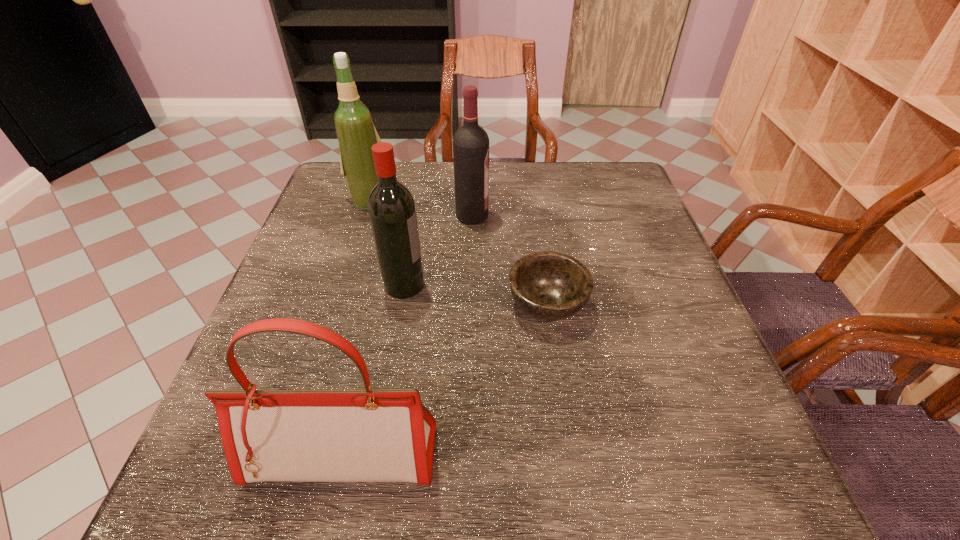
Identify the location of vacant space at the far left corner of the desktop. point(330,176).

The image size is (960, 540). In the image, there is a desktop. Identify the location of vacant space at the far right corner. (635, 187).

The height and width of the screenshot is (540, 960). I want to click on free spot between the nearest wine bottle and the rightmost object, so click(x=476, y=294).

Where is `free spot between the handbag and the leftmost wine bottle`? free spot between the handbag and the leftmost wine bottle is located at coordinates (357, 329).

Where is `free area in between the second wine bottle from right to left and the handbag`? This screenshot has height=540, width=960. free area in between the second wine bottle from right to left and the handbag is located at coordinates (373, 370).

Find the location of `free spot between the bowl and the nearest wine bottle`. free spot between the bowl and the nearest wine bottle is located at coordinates coord(476,294).

Locate an element on the screen. This screenshot has width=960, height=540. vacant space that is in between the shortest object and the second wine bottle from left to right is located at coordinates (476, 294).

Find the location of a particular element. vacant region between the nearest object and the nearest wine bottle is located at coordinates (373, 370).

I want to click on vacant area that lies between the rightmost object and the rightmost wine bottle, so click(510, 260).

This screenshot has width=960, height=540. In order to click on free point between the second wine bottle from left to right and the shortest object in this screenshot , I will do `click(476, 294)`.